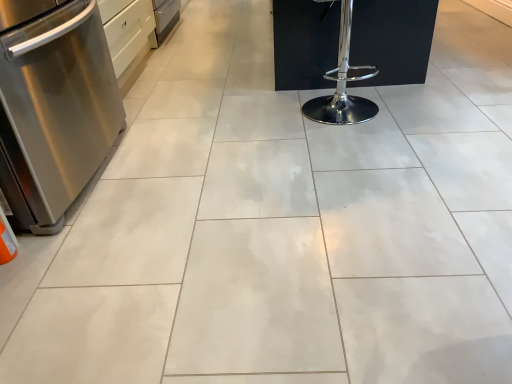
Question: Is stainless steel dishwasher at left not inside chrome/metallic bar stool at center-right?

Choices:
 (A) yes
 (B) no

Answer: (A)

Question: Is there a large distance between stainless steel dishwasher at left and chrome/metallic bar stool at center-right?

Choices:
 (A) no
 (B) yes

Answer: (B)

Question: Is stainless steel dishwasher at left closer to camera compared to chrome/metallic bar stool at center-right?

Choices:
 (A) no
 (B) yes

Answer: (B)

Question: Considering the relative sizes of stainless steel dishwasher at left and chrome/metallic bar stool at center-right in the image provided, is stainless steel dishwasher at left shorter than chrome/metallic bar stool at center-right?

Choices:
 (A) yes
 (B) no

Answer: (B)

Question: Could you tell me if stainless steel dishwasher at left is facing chrome/metallic bar stool at center-right?

Choices:
 (A) no
 (B) yes

Answer: (B)

Question: From the image's perspective, is stainless steel dishwasher at left on chrome/metallic bar stool at center-right?

Choices:
 (A) yes
 (B) no

Answer: (B)

Question: Is chrome/metallic bar stool at center-right facing away from stainless steel dishwasher at left?

Choices:
 (A) no
 (B) yes

Answer: (A)

Question: Can you confirm if chrome/metallic bar stool at center-right is taller than stainless steel dishwasher at left?

Choices:
 (A) yes
 (B) no

Answer: (B)

Question: Is chrome/metallic bar stool at center-right bigger than stainless steel dishwasher at left?

Choices:
 (A) no
 (B) yes

Answer: (A)

Question: Does chrome/metallic bar stool at center-right turn towards stainless steel dishwasher at left?

Choices:
 (A) no
 (B) yes

Answer: (A)

Question: Is chrome/metallic bar stool at center-right smaller than stainless steel dishwasher at left?

Choices:
 (A) yes
 (B) no

Answer: (A)

Question: From a real-world perspective, is chrome/metallic bar stool at center-right physically above stainless steel dishwasher at left?

Choices:
 (A) yes
 (B) no

Answer: (B)

Question: In terms of height, does chrome/metallic bar stool at center-right look taller or shorter compared to stainless steel dishwasher at left?

Choices:
 (A) short
 (B) tall

Answer: (A)